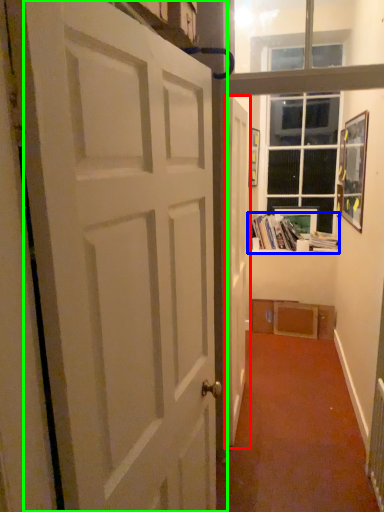
Question: Considering the real-world distances, which object is closest to door (highlighted by a red box)? book (highlighted by a blue box) or door (highlighted by a green box).

Choices:
 (A) book
 (B) door

Answer: (B)